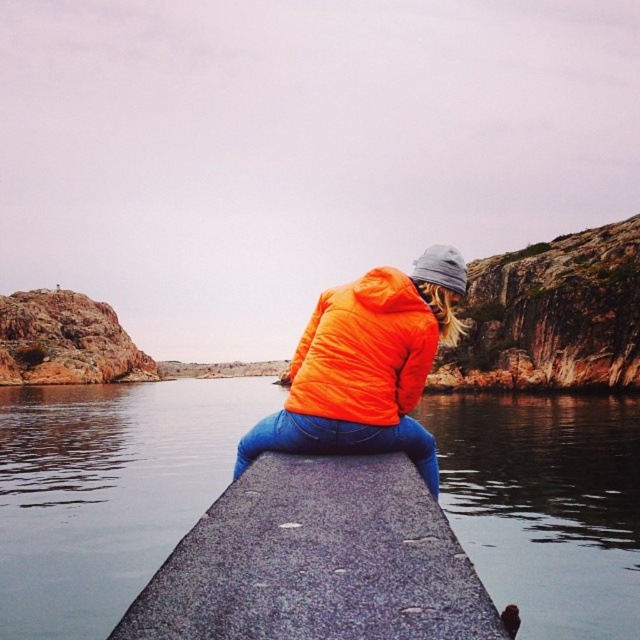
Question: Can you confirm if smooth dark water at dock center is positioned to the right of orange matte jacket at center?

Choices:
 (A) yes
 (B) no

Answer: (B)

Question: Which point appears farthest from the camera in this image?

Choices:
 (A) (333, 452)
 (B) (352, 346)

Answer: (B)

Question: Can you confirm if gray speckled concrete at center is positioned below orange matte jacket at center?

Choices:
 (A) yes
 (B) no

Answer: (A)

Question: Which object appears farthest from the camera in this image?

Choices:
 (A) orange synthetic jacket at center
 (B) smooth dark water at dock center

Answer: (B)

Question: Which point is closer to the camera?

Choices:
 (A) orange matte jacket at center
 (B) gray speckled concrete at center
 (C) orange synthetic jacket at center

Answer: (B)

Question: Is smooth dark water at dock center bigger than orange matte jacket at center?

Choices:
 (A) no
 (B) yes

Answer: (B)